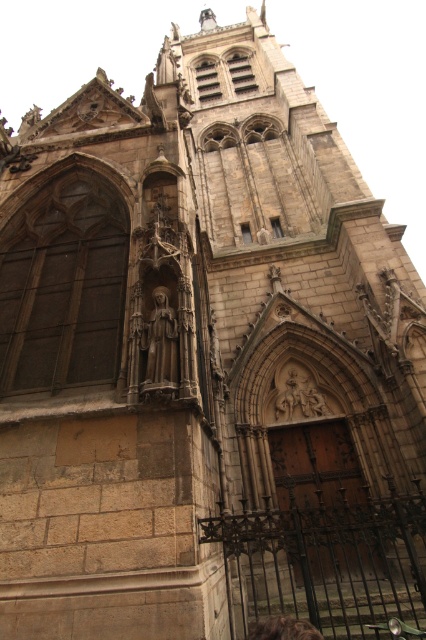
Can you confirm if smooth stone statue at center is shorter than brown leather bag at lower center?

Indeed, smooth stone statue at center has a lesser height compared to brown leather bag at lower center.

Consider the image. Does smooth stone statue at center appear on the left side of brown leather bag at lower center?

Yes, smooth stone statue at center is to the left of brown leather bag at lower center.

Is point (152, 340) farther from camera compared to point (279, 624)?

Yes, it is.

Image resolution: width=426 pixels, height=640 pixels. What are the coordinates of `smooth stone statue at center` in the screenshot? It's located at (161, 339).